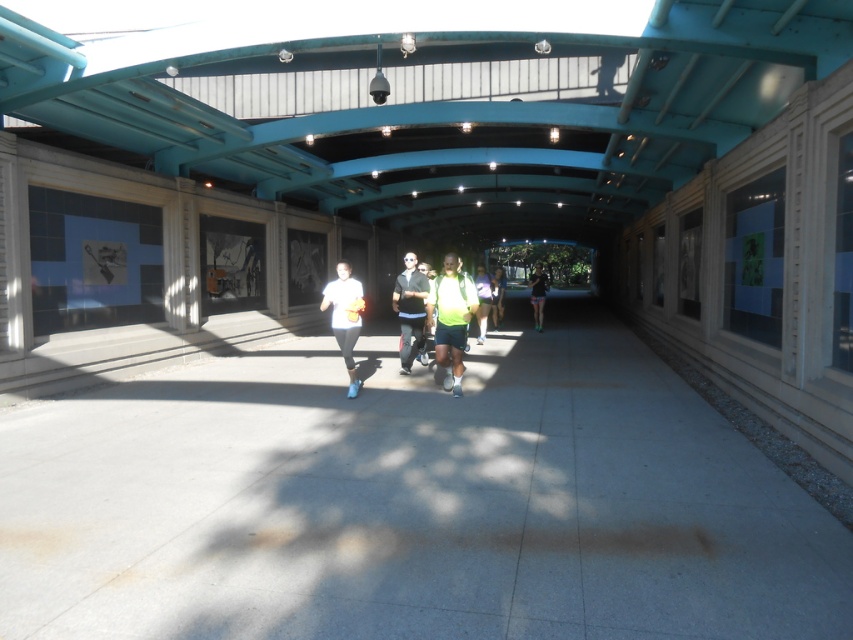
You are a GUI agent. You are given a task and a screenshot of the screen. Output one action in this format:
    pyautogui.click(x=<x>, y=<y>)
    Task: Click on the gray concrete pavement at center
    This screenshot has width=853, height=640.
    Given the screenshot: What is the action you would take?
    pyautogui.click(x=410, y=502)

What do you see at coordinates (410, 502) in the screenshot? This screenshot has height=640, width=853. I see `gray concrete pavement at center` at bounding box center [410, 502].

Between point (643, 570) and point (537, 294), which one is positioned in front?

Point (643, 570)

Find the location of a particular element. Image resolution: width=853 pixels, height=640 pixels. gray concrete pavement at center is located at coordinates (410, 502).

Which is above, gray concrete pavement at center or matte black jacket at center?

matte black jacket at center is higher up.

Which of these two, gray concrete pavement at center or matte black jacket at center, stands taller?

With more height is matte black jacket at center.

The width and height of the screenshot is (853, 640). Identify the location of gray concrete pavement at center. (410, 502).

Is gray concrete pavement at center positioned before green reflective vest at center?

Yes, gray concrete pavement at center is closer to the viewer.

Does gray concrete pavement at center have a smaller size compared to green reflective vest at center?

Yes.

Is point (694, 545) farther from viewer compared to point (496, 307)?

No.

The image size is (853, 640). I want to click on gray concrete pavement at center, so click(x=410, y=502).